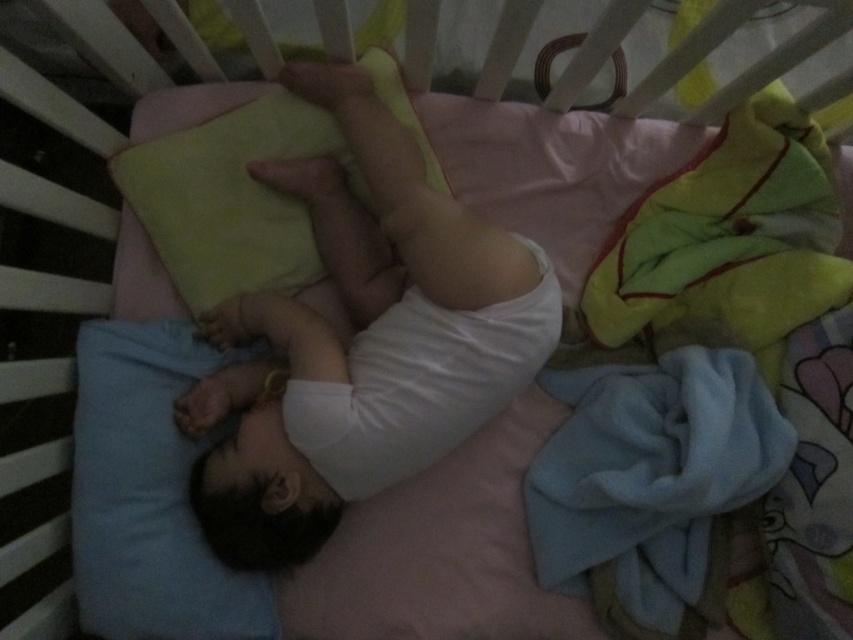
Question: Which point appears closest to the camera in this image?

Choices:
 (A) (405, 476)
 (B) (496, 358)

Answer: (B)

Question: Which object appears farthest from the camera in this image?

Choices:
 (A) yellow soft blanket at upper right
 (B) blue soft pillow at lower left
 (C) white cloth diaper at center
 (D) white soft baby at center

Answer: (D)

Question: Which point appears closest to the camera in this image?

Choices:
 (A) (688, 180)
 (B) (74, 570)
 (C) (312, 388)
 (D) (268, 566)

Answer: (C)

Question: Is white soft baby at center positioned before yellow soft blanket at upper right?

Choices:
 (A) no
 (B) yes

Answer: (A)

Question: Is blue soft pillow at lower left bigger than white cloth diaper at center?

Choices:
 (A) yes
 (B) no

Answer: (B)

Question: Is yellow soft blanket at upper right thinner than blue soft pillow at lower left?

Choices:
 (A) no
 (B) yes

Answer: (A)